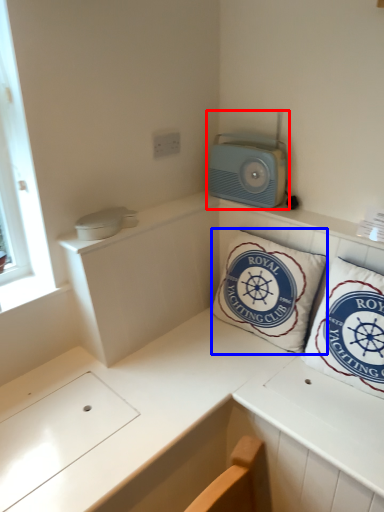
Question: Among these objects, which one is farthest to the camera, appliance (highlighted by a red box) or pillow (highlighted by a blue box)?

Choices:
 (A) appliance
 (B) pillow

Answer: (A)